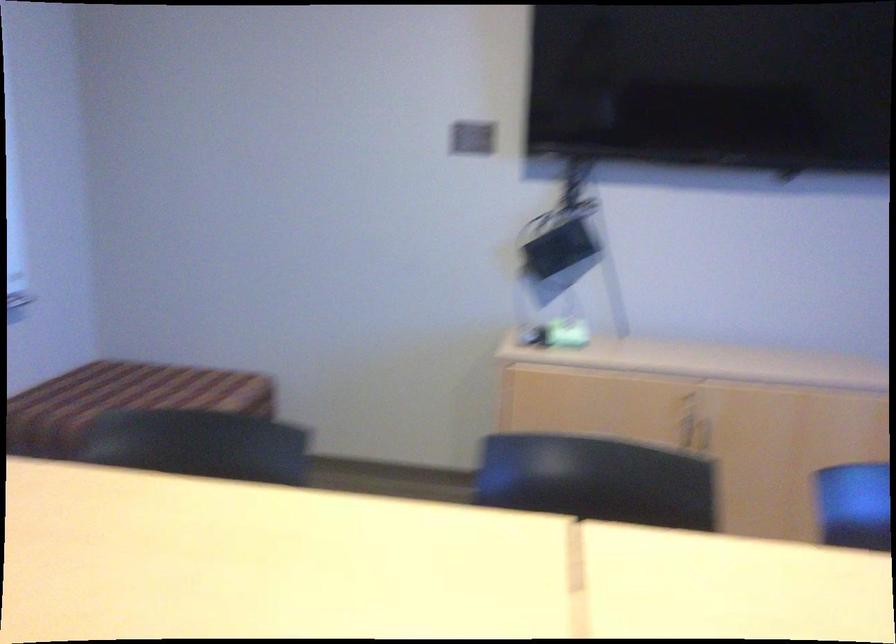
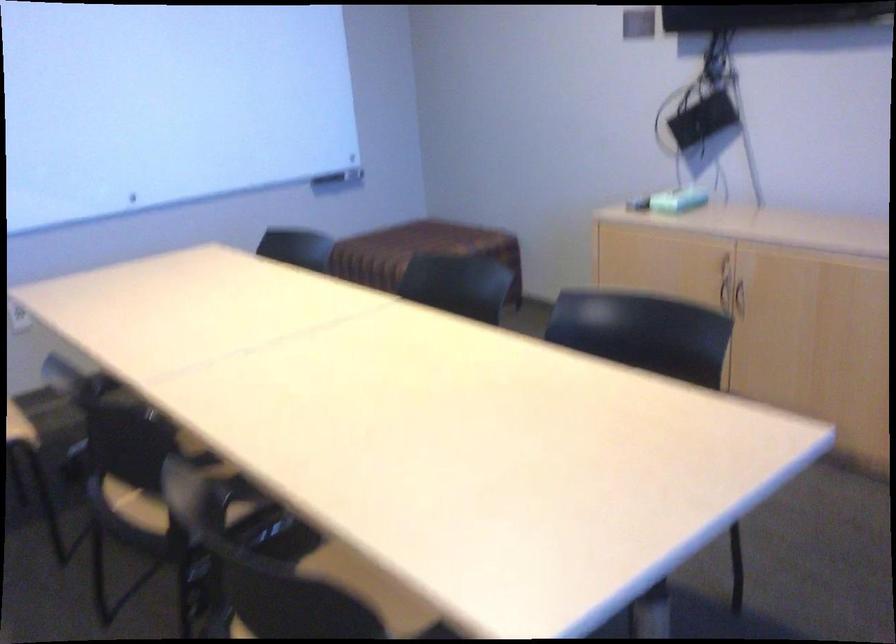
In the second image, find the point that corresponds to [659,438] in the first image.

(725, 295)